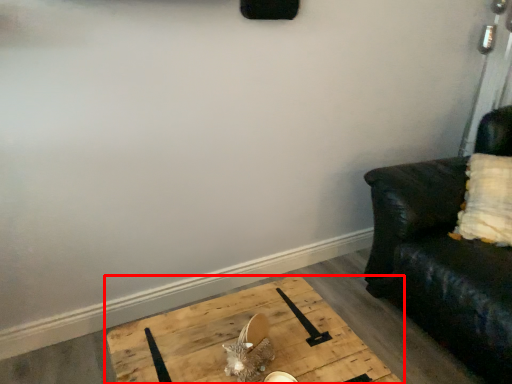
Question: From the image's perspective, where is table (annotated by the red box) located relative to studio couch?

Choices:
 (A) above
 (B) below

Answer: (B)